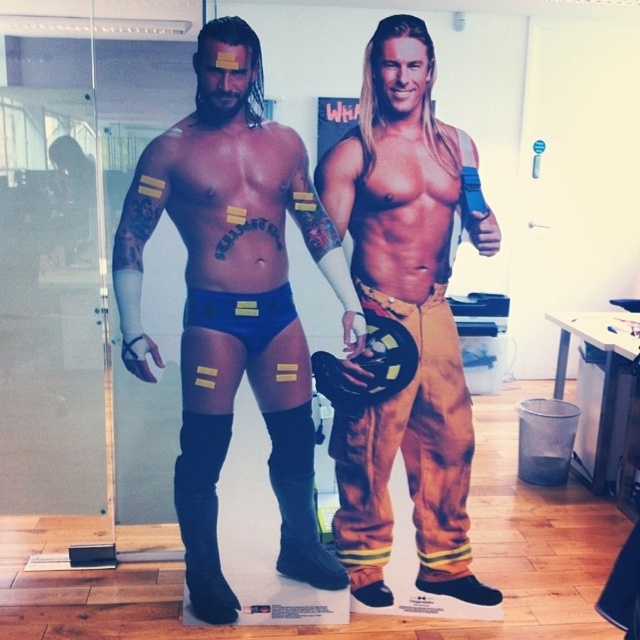
You are an interior designer arranging a space with the two figures. You need to place a small plant between the matte blue shorts at center and the black suede boot at lower left. Where should you position the plant to ensure it is between them?

Place the plant between the matte blue shorts at center and the black suede boot at lower left so it is below the shorts and above the boot since the shorts are above the boot.

You are an interior designer arranging furniture in this office. You need to place a new decorative item between the matte blue shorts at center and the black suede boot at lower center. Based on their positions, which side should you place it on to ensure it is between them?

The matte blue shorts at center is positioned on the left side of black suede boot at lower center, so placing the decorative item between them would require positioning it to the right of the matte blue shorts at center and to the left of the black suede boot at lower center.

What are the coordinates of the matte blue shorts at center?

The coordinates of the matte blue shorts at center are at point (234, 305).